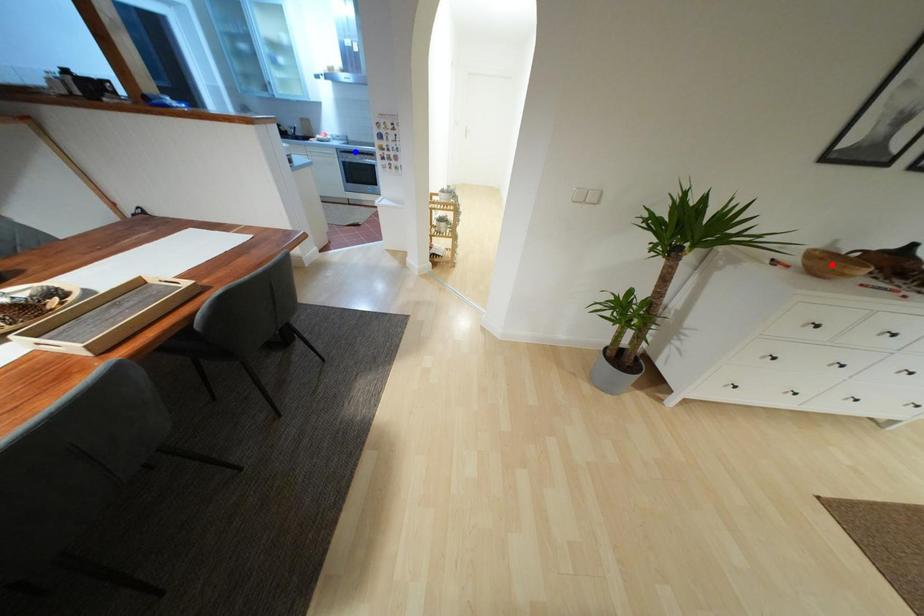
Question: In the image, two points are highlighted. Which point is nearer to the camera? Reply with the corresponding letter.

Choices:
 (A) blue point
 (B) red point

Answer: (B)